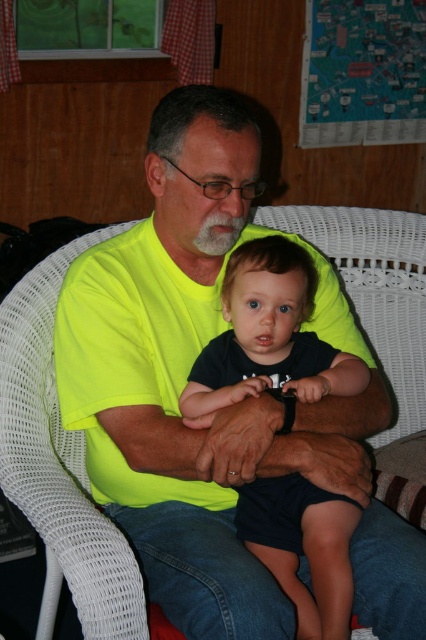
Question: Can you confirm if neon yellow t-shirt at center is positioned to the right of dark blue fabric at center?

Choices:
 (A) no
 (B) yes

Answer: (A)

Question: Does neon yellow t-shirt at center appear under dark blue fabric at center?

Choices:
 (A) yes
 (B) no

Answer: (B)

Question: Which of the following is the closest to the observer?

Choices:
 (A) dark blue fabric at center
 (B) neon yellow t-shirt at center

Answer: (B)

Question: Among these objects, which one is nearest to the camera?

Choices:
 (A) dark blue fabric at center
 (B) neon yellow t-shirt at center

Answer: (B)

Question: Is neon yellow t-shirt at center to the right of dark blue fabric at center from the viewer's perspective?

Choices:
 (A) yes
 (B) no

Answer: (B)